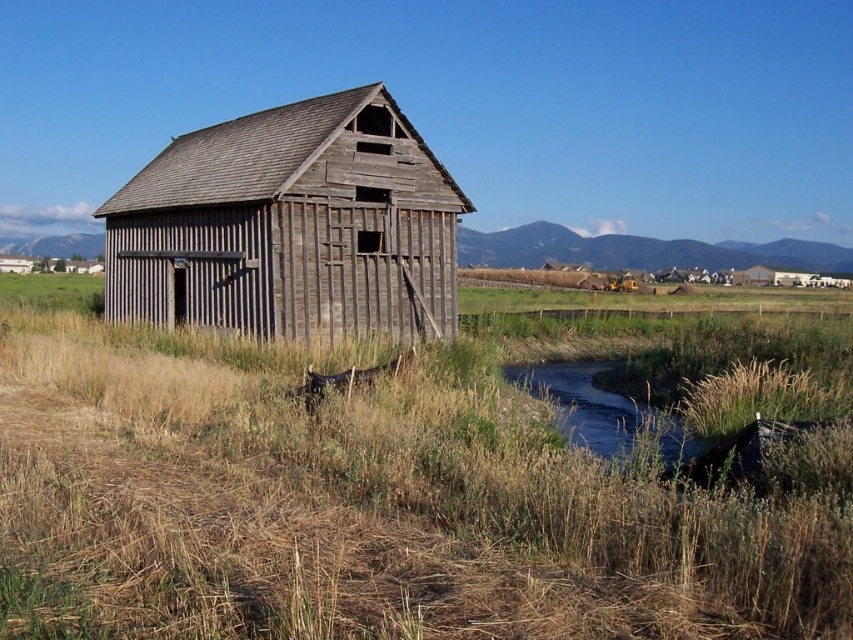
You are a farmer checking the condition of your property. You notice the dry grass at center and the weathered wood barn at center. Which object appears smaller in the image?

The dry grass at center appears smaller compared to the weathered wood barn at center according to the description.

You are a hiker who wants to cross the green grassy creek at lower center to reach the barn. The dry grass at center is in your path. Which path should you choose to avoid getting wet?

You should choose the dry grass at center path since the green grassy creek at lower center is a waterway and would get you wet.

You are standing in front of the old barn and want to determine the relative positions of two points marked on the barn wall. The first point is at coordinates point (430, 624) and the second is at point (596, 397). Which point is closer to you?

Point (430, 624) is closer to the viewer than point .622, 0.701.